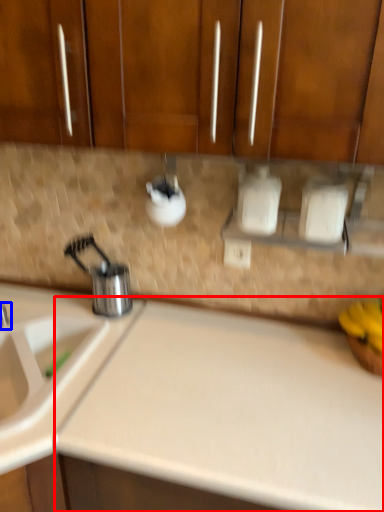
Question: Among these objects, which one is farthest to the camera, counter top (highlighted by a red box) or tap (highlighted by a blue box)?

Choices:
 (A) counter top
 (B) tap

Answer: (B)